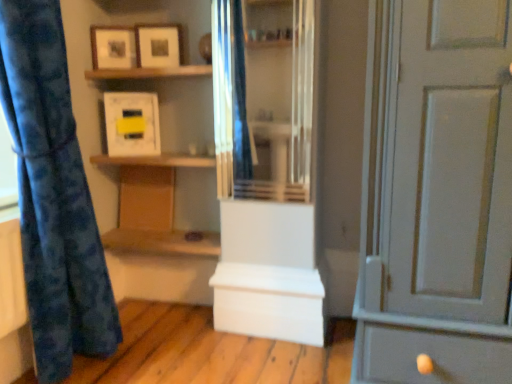
Question: Considering the relative sizes of white matte storage box at center, which is the 1th cabinetry in right-to-left order, and matte white picture frame at upper center, arranged as the 3th picture frame when viewed from the top, in the image provided, is white matte storage box at center, which is the 1th cabinetry in right-to-left order, thinner than matte white picture frame at upper center, arranged as the 3th picture frame when viewed from the top,?

Choices:
 (A) yes
 (B) no

Answer: (B)

Question: Considering the relative sizes of white matte storage box at center, positioned as the 2th cabinetry in left-to-right order, and matte white picture frame at upper center, which is the first picture frame in bottom-to-top order, in the image provided, is white matte storage box at center, positioned as the 2th cabinetry in left-to-right order, wider than matte white picture frame at upper center, which is the first picture frame in bottom-to-top order,?

Choices:
 (A) no
 (B) yes

Answer: (B)

Question: Does white matte storage box at center, positioned as the 2th cabinetry in left-to-right order, have a lesser height compared to matte white picture frame at upper center, which is the first picture frame in bottom-to-top order?

Choices:
 (A) yes
 (B) no

Answer: (B)

Question: From a real-world perspective, is white matte storage box at center, which ranks as the 1th cabinetry in front-to-back order, under matte white picture frame at upper center, which is the first picture frame in bottom-to-top order?

Choices:
 (A) no
 (B) yes

Answer: (B)

Question: Does white matte storage box at center, which is the second cabinetry in top-to-bottom order, turn towards matte white picture frame at upper center, arranged as the 3th picture frame when viewed from the top?

Choices:
 (A) no
 (B) yes

Answer: (A)

Question: Is clear glass cabinet at center to the left or to the right of blue fabric curtain at left in the image?

Choices:
 (A) left
 (B) right

Answer: (B)

Question: Is clear glass cabinet at center in front of or behind blue fabric curtain at left in the image?

Choices:
 (A) front
 (B) behind

Answer: (B)

Question: Which is correct: clear glass cabinet at center is inside blue fabric curtain at left, or outside of it?

Choices:
 (A) inside
 (B) outside

Answer: (B)

Question: Is clear glass cabinet at center bigger or smaller than blue fabric curtain at left?

Choices:
 (A) big
 (B) small

Answer: (B)

Question: In terms of width, does white painted wood door at right look wider or thinner when compared to wooden shelf at center, the 2th shelf in the top-to-bottom sequence?

Choices:
 (A) wide
 (B) thin

Answer: (A)

Question: Is point (499, 182) positioned closer to the camera than point (183, 155)?

Choices:
 (A) farther
 (B) closer

Answer: (B)

Question: Is white painted wood door at right bigger or smaller than wooden shelf at center, the 2th shelf in the top-to-bottom sequence?

Choices:
 (A) big
 (B) small

Answer: (A)

Question: From a real-world perspective, is white painted wood door at right physically located above or below wooden shelf at center, arranged as the 1th shelf when ordered from the bottom?

Choices:
 (A) above
 (B) below

Answer: (B)

Question: In terms of height, does wooden shelf at center, arranged as the 1th shelf when ordered from the bottom, look taller or shorter compared to matte white picture frame at upper center, arranged as the 3th picture frame when viewed from the top?

Choices:
 (A) short
 (B) tall

Answer: (A)

Question: Visually, is wooden shelf at center, arranged as the 1th shelf when ordered from the bottom, positioned to the left or to the right of matte white picture frame at upper center, which is the first picture frame in bottom-to-top order?

Choices:
 (A) right
 (B) left

Answer: (A)